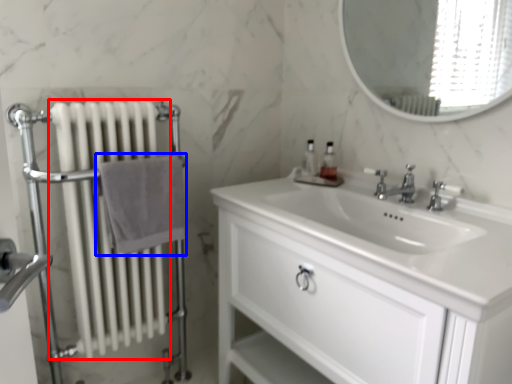
Question: Which object appears closest to the camera in this image, radiator (highlighted by a red box) or bath towel (highlighted by a blue box)?

Choices:
 (A) radiator
 (B) bath towel

Answer: (A)